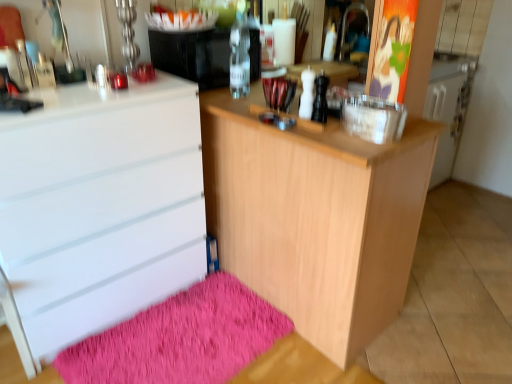
Where is `vacant area that is in front of clear glass bottle at center`? The width and height of the screenshot is (512, 384). vacant area that is in front of clear glass bottle at center is located at coordinates (250, 100).